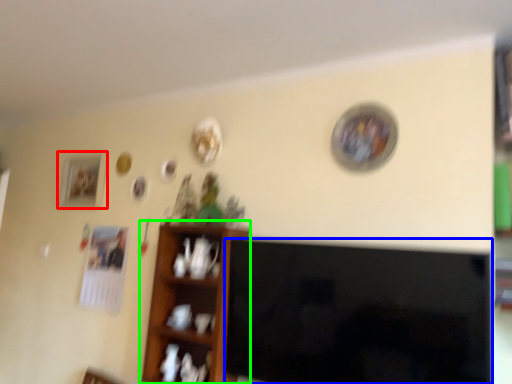
Question: Estimate the real-world distances between objects in this image. Which object is farther from picture frame (highlighted by a red box), television (highlighted by a blue box) or shelf (highlighted by a green box)?

Choices:
 (A) television
 (B) shelf

Answer: (A)